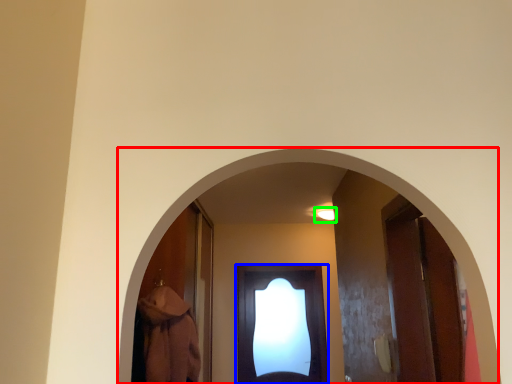
Question: Which object is the closest to the archway (highlighted by a red box)? Choose among these: door (highlighted by a blue box) or light (highlighted by a green box).

Choices:
 (A) door
 (B) light

Answer: (B)